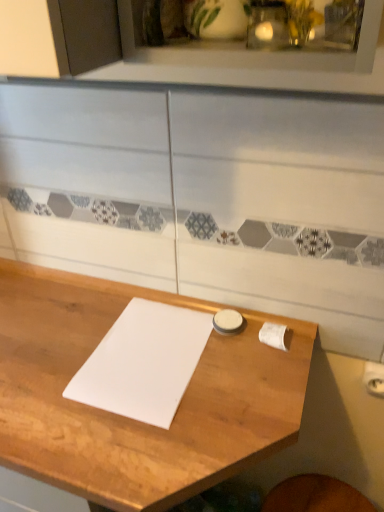
Image resolution: width=384 pixels, height=512 pixels. What are the coordinates of `vacant area in front of white matte journal at center` in the screenshot? It's located at point(139,446).